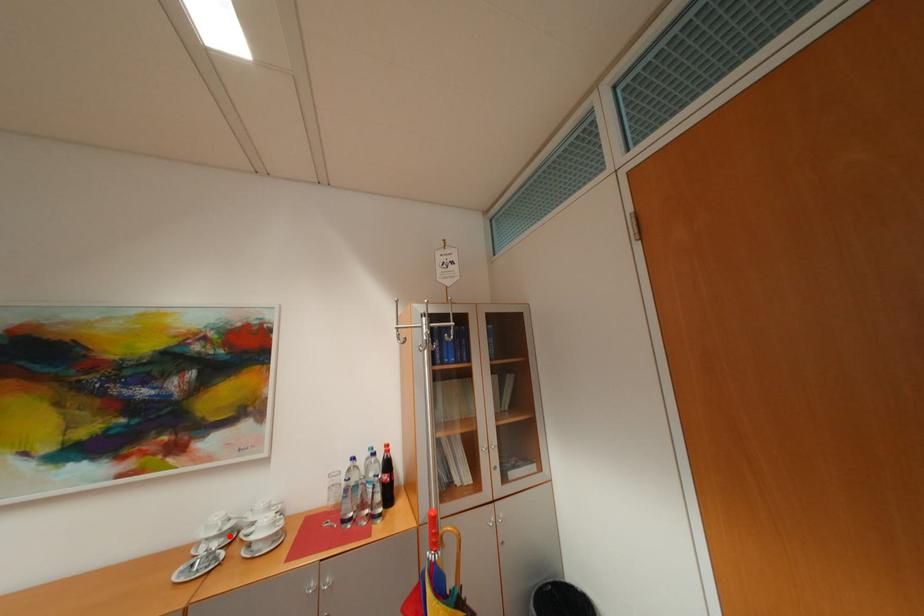
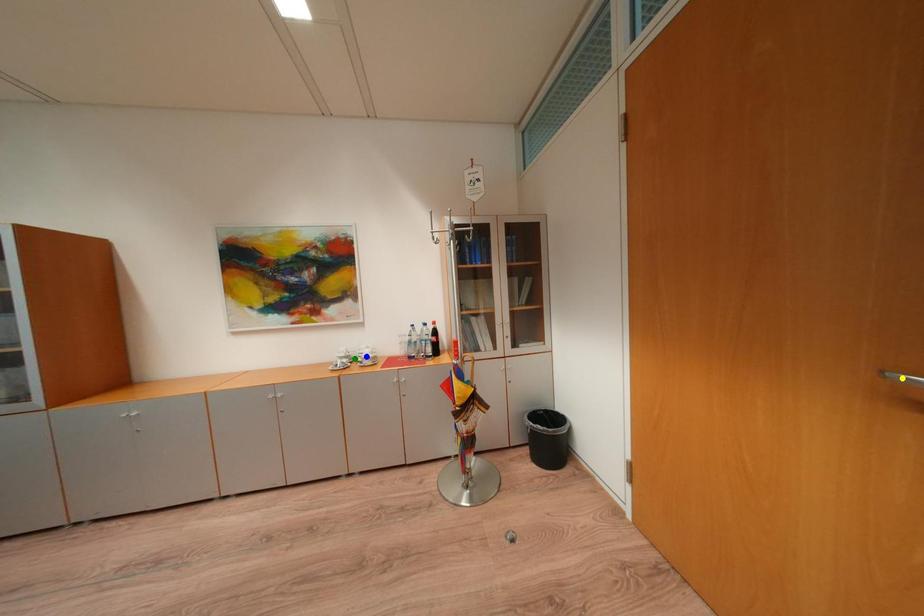
Question: I am providing you with two images of the same scene from different viewpoints. A red point is marked on the first image. You are given multiple points on the second image. Can you choose the point in image 2 that corresponds to the point in image 1?

Choices:
 (A) blue point
 (B) green point
 (C) yellow point

Answer: (B)